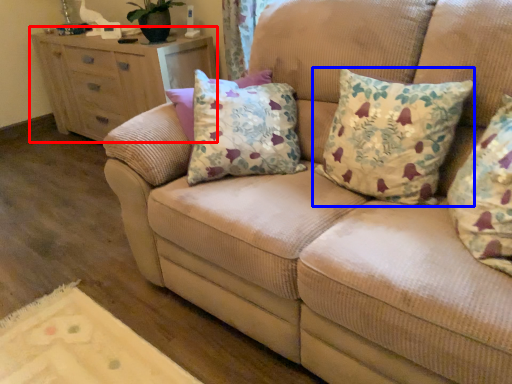
Question: Which object is further to the camera taking this photo, chest of drawers (highlighted by a red box) or pillow (highlighted by a blue box)?

Choices:
 (A) chest of drawers
 (B) pillow

Answer: (A)